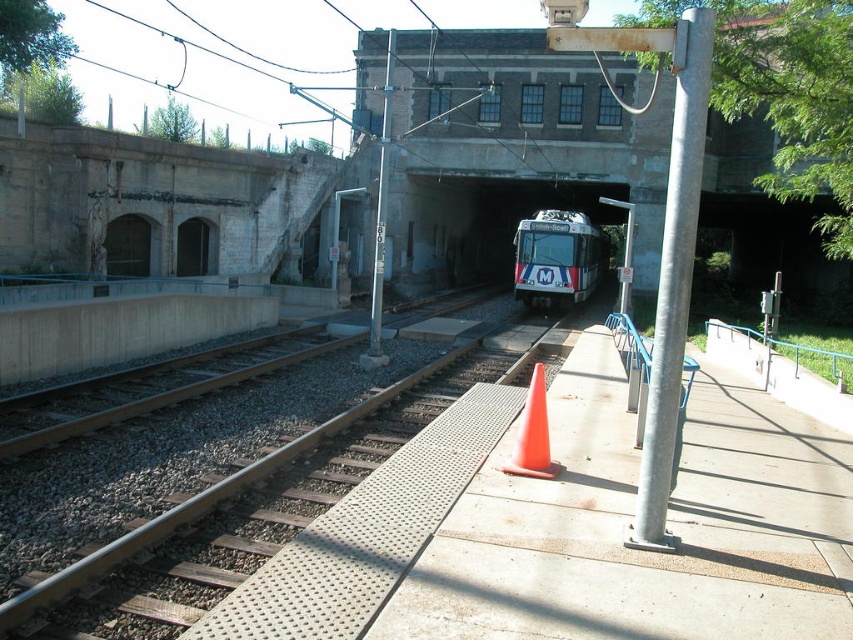
Is gray gravel train track at center closer to camera compared to brown gravel train track at center?

Yes.

Which of these two, gray gravel train track at center or brown gravel train track at center, stands shorter?

gray gravel train track at center is shorter.

Locate an element on the screen. gray gravel train track at center is located at coordinates (247, 512).

Image resolution: width=853 pixels, height=640 pixels. Identify the location of gray gravel train track at center. (247, 512).

Can you confirm if gray gravel train track at center is wider than orange matte traffic cone at center?

Yes, gray gravel train track at center is wider than orange matte traffic cone at center.

Is point (300, 529) positioned after point (531, 388)?

Yes, it is.

Does point (112, 605) lie in front of point (532, 397)?

Yes, point (112, 605) is closer to viewer.

Locate an element on the screen. The image size is (853, 640). gray gravel train track at center is located at coordinates (247, 512).

Is point (553, 264) positioned before point (546, 420)?

No, it is behind (546, 420).

Between white glossy train at center and orange matte traffic cone at center, which one appears on the left side from the viewer's perspective?

orange matte traffic cone at center

Which is behind, point (544, 275) or point (541, 416)?

The point (544, 275) is more distant.

The height and width of the screenshot is (640, 853). I want to click on white glossy train at center, so click(x=556, y=257).